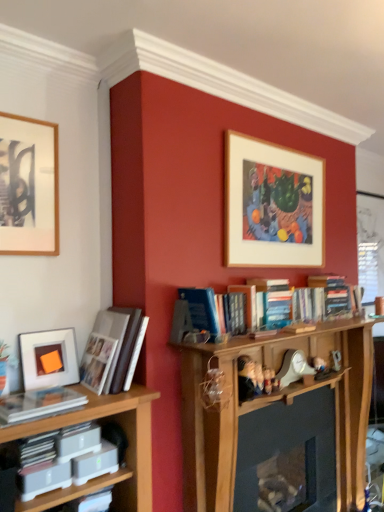
The image size is (384, 512). In order to click on matte white picture frame at left, which ranks as the 2th picture frame in right-to-left order in this screenshot , I will do `click(48, 358)`.

Describe the element at coordinates (370, 245) in the screenshot. I see `white mesh screen at right` at that location.

The image size is (384, 512). Identify the location of white plastic toy at center. (293, 368).

Which is more to the left, matte white paperback book at lower left or white glossy photo album at left, positioned as the first book in top-to-bottom order?

matte white paperback book at lower left.

Which object is wider, matte white paperback book at lower left or white glossy photo album at left, positioned as the first book in top-to-bottom order?

white glossy photo album at left, positioned as the first book in top-to-bottom order, is wider.

Identify the location of book on the right of matte white paperback book at lower left. The width and height of the screenshot is (384, 512). 113,350.

Which is farther, (89,473) or (110,338)?

The point (110,338) is behind.

Which object is closer to the camera, matte white paperback book at lower left or wooden picture frame at upper left, which appears as the 2th picture frame when viewed from the front?

matte white paperback book at lower left.

In the scene shown: Measure the distance between matte white paperback book at lower left and wooden picture frame at upper left, which appears as the 2th picture frame when viewed from the front.

matte white paperback book at lower left and wooden picture frame at upper left, which appears as the 2th picture frame when viewed from the front, are 1.05 meters apart.

Is matte white paperback book at lower left located outside wooden picture frame at upper left, acting as the 3th picture frame starting from the right?

Indeed, matte white paperback book at lower left is completely outside wooden picture frame at upper left, acting as the 3th picture frame starting from the right.

Visually, is matte white paperback book at lower left positioned to the left or to the right of wooden picture frame at upper left, which is the 2th picture frame from back to front?

matte white paperback book at lower left is positioned on wooden picture frame at upper left, which is the 2th picture frame from back to front,'s right side.

Would you say wooden picture frame at upper center, which is the 1th picture frame in back-to-front order, is outside clear plastic book at lower left, the first book from the bottom?

Yes.

Can you see wooden picture frame at upper center, acting as the 3th picture frame starting from the front, touching clear plastic book at lower left, the first book from the bottom?

They are not placed beside each other.

Does wooden picture frame at upper center, acting as the 3th picture frame starting from the front, have a smaller size compared to clear plastic book at lower left, which is counted as the second book, starting from the top?

No.

From the image's perspective, is wooden picture frame at upper center, acting as the third picture frame starting from the left, above or below clear plastic book at lower left, arranged as the second book when viewed from the back?

Based on their image positions, wooden picture frame at upper center, acting as the third picture frame starting from the left, is located above clear plastic book at lower left, arranged as the second book when viewed from the back.

Can you confirm if wooden picture frame at upper left, which appears as the 2th picture frame when viewed from the front, is shorter than clear plastic book at lower left, arranged as the second book when viewed from the back?

Incorrect, the height of wooden picture frame at upper left, which appears as the 2th picture frame when viewed from the front, does not fall short of that of clear plastic book at lower left, arranged as the second book when viewed from the back.

Can you confirm if wooden picture frame at upper left, which appears as the 2th picture frame when viewed from the front, is positioned to the right of clear plastic book at lower left, the 1th book viewed from the front?

In fact, wooden picture frame at upper left, which appears as the 2th picture frame when viewed from the front, is to the left of clear plastic book at lower left, the 1th book viewed from the front.

What's the angular difference between wooden picture frame at upper left, acting as the 3th picture frame starting from the right, and clear plastic book at lower left, the 1th book viewed from the front,'s facing directions?

The facing directions of wooden picture frame at upper left, acting as the 3th picture frame starting from the right, and clear plastic book at lower left, the 1th book viewed from the front, are 1.2 degrees apart.

Is wooden picture frame at upper left, which appears as the 2th picture frame when viewed from the front, outside of clear plastic book at lower left, which is counted as the second book, starting from the top?

Indeed, wooden picture frame at upper left, which appears as the 2th picture frame when viewed from the front, is completely outside clear plastic book at lower left, which is counted as the second book, starting from the top.

Is matte white picture frame at left, acting as the 3th picture frame starting from the back, in front of or behind matte white paperback book at lower left in the image?

Visually, matte white picture frame at left, acting as the 3th picture frame starting from the back, is located behind matte white paperback book at lower left.

From a real-world perspective, who is located higher, matte white picture frame at left, which ranks as the 2th picture frame in right-to-left order, or matte white paperback book at lower left?

From a 3D spatial view, matte white picture frame at left, which ranks as the 2th picture frame in right-to-left order, is above.

Between matte white picture frame at left, positioned as the 2th picture frame in left-to-right order, and matte white paperback book at lower left, which one has smaller size?

matte white paperback book at lower left is smaller.

From the image's perspective, is matte white picture frame at left, positioned as the 2th picture frame in left-to-right order, on matte white paperback book at lower left?

Yes, from the image's perspective, matte white picture frame at left, positioned as the 2th picture frame in left-to-right order, is above matte white paperback book at lower left.

Identify the location of book on the right of matte white paperback book at lower left. The height and width of the screenshot is (512, 384). (113, 350).

Is white glossy photo album at left, which appears as the 2th book when viewed from the front, oriented towards matte white paperback book at lower left?

No, white glossy photo album at left, which appears as the 2th book when viewed from the front, is not facing towards matte white paperback book at lower left.

In the scene shown: Is white glossy photo album at left, which is the second book from bottom to top, at the left side of matte white paperback book at lower left?

No.

From the image's perspective, who appears lower, white glossy photo album at left, positioned as the first book in top-to-bottom order, or matte white paperback book at lower left?

From the image's view, matte white paperback book at lower left is below.

From the image's perspective, which one is positioned higher, matte white paperback book at lower left or white plastic toy at center?

white plastic toy at center is shown above in the image.

Does matte white paperback book at lower left have a greater height compared to white plastic toy at center?

In fact, matte white paperback book at lower left may be shorter than white plastic toy at center.

Does point (114, 454) come in front of point (281, 368)?

Yes, point (114, 454) is in front of point (281, 368).

The height and width of the screenshot is (512, 384). What are the coordinates of `toy above the matte white paperback book at lower left (from the image's perspective)` in the screenshot? It's located at (293, 368).

From a real-world perspective, count 2nd books upward from the matte white paperback book at lower left and point to it. Please provide its 2D coordinates.

[(113, 350)]

Identify the location of paperback book on the right of wooden picture frame at upper left, positioned as the 1th picture frame in left-to-right order. The width and height of the screenshot is (384, 512). (95, 463).

Looking at the image, which one is located further to wooden picture frame at upper left, which is the 2th picture frame from back to front, clear plastic book at lower left, the first book from the bottom, or matte white picture frame at left, acting as the 3th picture frame starting from the back?

clear plastic book at lower left, the first book from the bottom, is further to wooden picture frame at upper left, which is the 2th picture frame from back to front.

Looking at the image, which one is located closer to white glossy photo album at left, positioned as the first book in top-to-bottom order, wooden picture frame at upper left, acting as the 3th picture frame starting from the right, or wooden picture frame at upper center, acting as the 3th picture frame starting from the front?

Based on the image, wooden picture frame at upper left, acting as the 3th picture frame starting from the right, appears to be nearer to white glossy photo album at left, positioned as the first book in top-to-bottom order.

Which object lies further to the anchor point matte white paperback book at lower left, wooden picture frame at upper center, the 1th picture frame in the right-to-left sequence, or clear plastic book at lower left, which is counted as the second book, starting from the top?

The object further to matte white paperback book at lower left is wooden picture frame at upper center, the 1th picture frame in the right-to-left sequence.

Looking at the image, which one is located further to white plastic toy at center, matte white picture frame at left, which ranks as the 2th picture frame in right-to-left order, or white mesh screen at right?

Based on the image, white mesh screen at right appears to be further to white plastic toy at center.

From the image, which object appears to be nearer to matte white paperback book at lower left, wooden picture frame at upper center, acting as the third picture frame starting from the left, or white plastic toy at center?

Based on the image, white plastic toy at center appears to be nearer to matte white paperback book at lower left.

When comparing their distances from white plastic toy at center, does clear plastic book at lower left, which is counted as the second book, starting from the top, or matte white picture frame at left, positioned as the 2th picture frame in left-to-right order, seem closer?

The object closer to white plastic toy at center is matte white picture frame at left, positioned as the 2th picture frame in left-to-right order.

In the scene shown: When comparing their distances from wooden picture frame at upper left, which is the 2th picture frame from back to front, does clear plastic book at lower left, which is counted as the second book, starting from the top, or matte white paperback book at lower left seem further?

Based on the image, matte white paperback book at lower left appears to be further to wooden picture frame at upper left, which is the 2th picture frame from back to front.

In the scene shown: Based on their spatial positions, is wooden picture frame at upper center, which is the 1th picture frame in back-to-front order, or white glossy photo album at left, which is the second book from bottom to top, closer to wooden picture frame at upper left, positioned as the 1th picture frame in left-to-right order?

The object closer to wooden picture frame at upper left, positioned as the 1th picture frame in left-to-right order, is white glossy photo album at left, which is the second book from bottom to top.

The height and width of the screenshot is (512, 384). Find the location of `paperback book between clear plastic book at lower left, the 1th book viewed from the front, and white plastic toy at center from left to right`. paperback book between clear plastic book at lower left, the 1th book viewed from the front, and white plastic toy at center from left to right is located at coordinates pyautogui.click(x=95, y=463).

Image resolution: width=384 pixels, height=512 pixels. Find the location of `paperback book between matte white picture frame at left, acting as the 3th picture frame starting from the back, and white plastic toy at center`. paperback book between matte white picture frame at left, acting as the 3th picture frame starting from the back, and white plastic toy at center is located at coordinates (95, 463).

The image size is (384, 512). What are the coordinates of `paperback book between matte white picture frame at left, acting as the 3th picture frame starting from the back, and wooden picture frame at upper center, which is the 1th picture frame in back-to-front order, from left to right` in the screenshot? It's located at (95, 463).

Where is `toy situated between wooden picture frame at upper left, acting as the 3th picture frame starting from the right, and white mesh screen at right from left to right`? Image resolution: width=384 pixels, height=512 pixels. toy situated between wooden picture frame at upper left, acting as the 3th picture frame starting from the right, and white mesh screen at right from left to right is located at coordinates (293, 368).